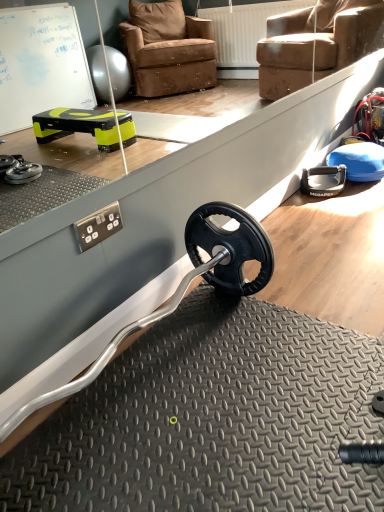
Image resolution: width=384 pixels, height=512 pixels. Find the location of `free space to the right of black rubber push-up at right`. free space to the right of black rubber push-up at right is located at coordinates click(361, 193).